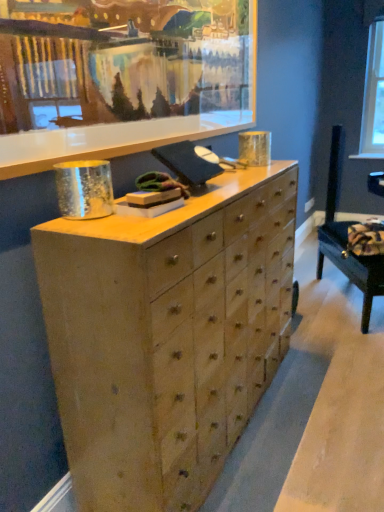
The width and height of the screenshot is (384, 512). In order to click on free space in front of velvet dark blue swivel chair at lower right in this screenshot , I will do coord(343,348).